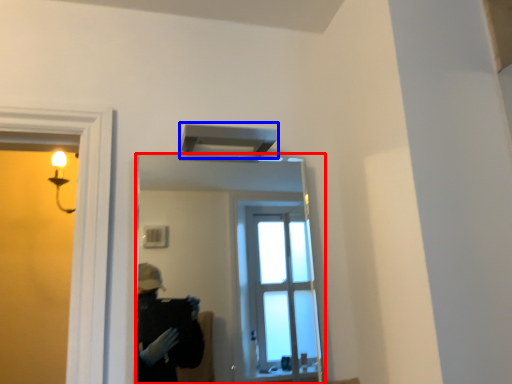
Question: Which object appears farthest to the camera in this image, mirror (highlighted by a red box) or exhaust hood (highlighted by a blue box)?

Choices:
 (A) mirror
 (B) exhaust hood

Answer: (B)